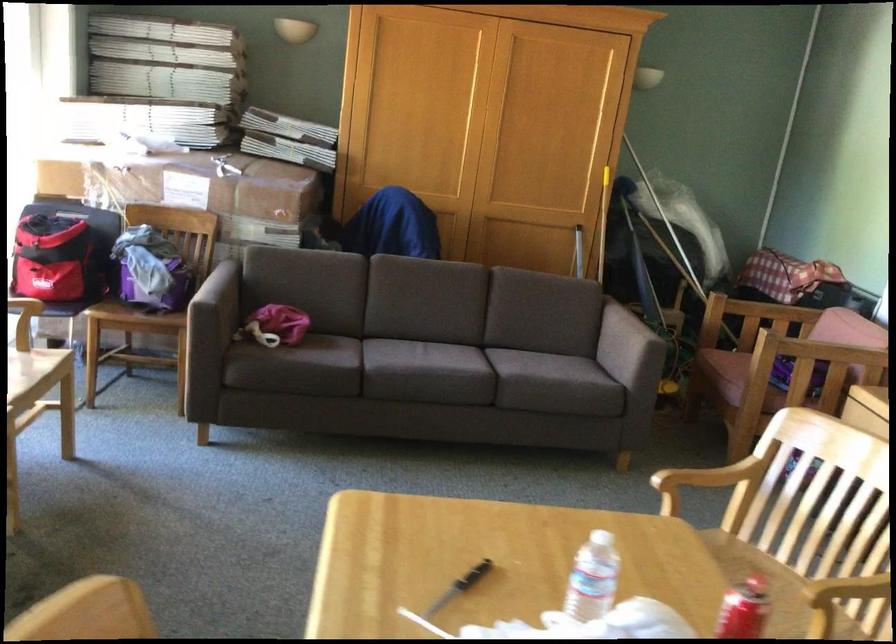
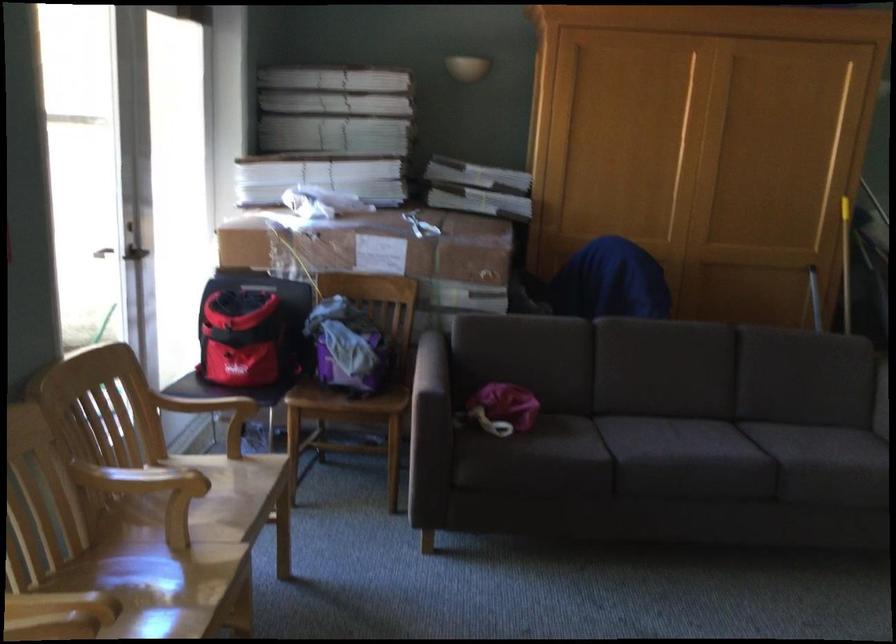
Locate, in the second image, the point that corresponds to point (152, 289) in the first image.

(352, 366)